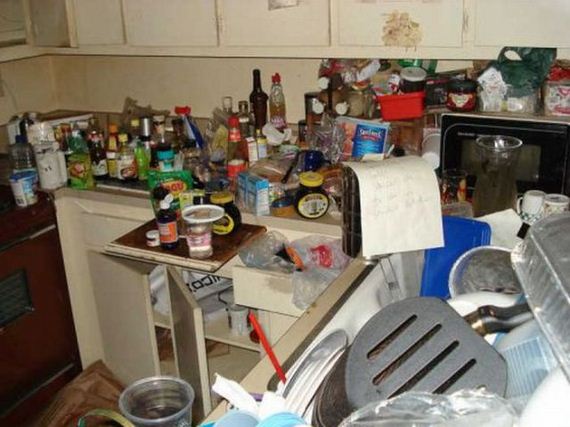
Locate an element on the screen. This screenshot has height=427, width=570. bare wall is located at coordinates (169, 79).